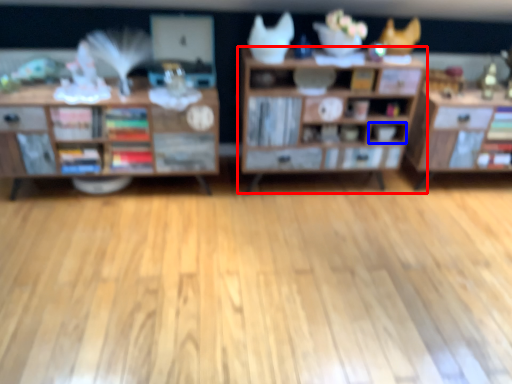
Question: Which object is closer to the camera taking this photo, shelf (highlighted by a red box) or cabinet (highlighted by a blue box)?

Choices:
 (A) shelf
 (B) cabinet

Answer: (A)